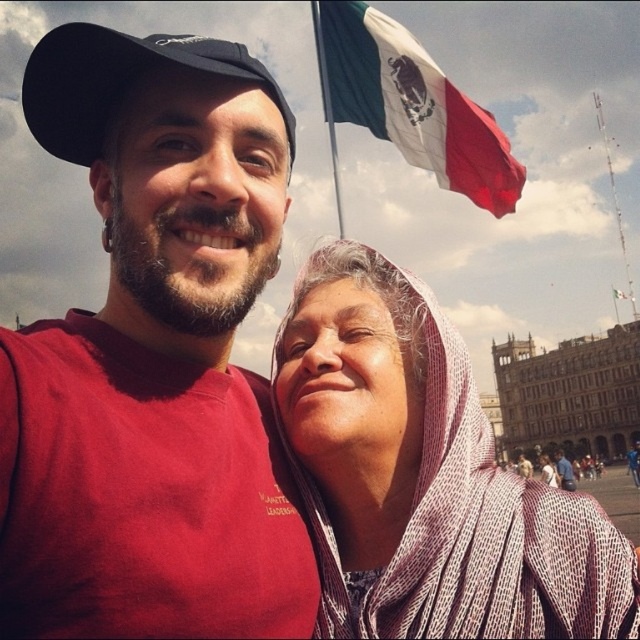
Question: Does matte red t-shirt at center have a smaller size compared to green-white-red fabric flag at upper center?

Choices:
 (A) yes
 (B) no

Answer: (B)

Question: Which object is farther from the camera taking this photo?

Choices:
 (A) white textured scarf at center
 (B) matte red t-shirt at center

Answer: (A)

Question: Which point appears farthest from the camera in this image?

Choices:
 (A) (448, 378)
 (B) (182, 64)
 (C) (444, 118)

Answer: (C)

Question: Does matte red t-shirt at center come in front of green-white-red fabric flag at upper center?

Choices:
 (A) no
 (B) yes

Answer: (B)

Question: Which point is closer to the camera?

Choices:
 (A) (104, 65)
 (B) (420, 118)
 (C) (204, 116)
 (D) (360, 372)

Answer: (A)

Question: Does matte red t-shirt at center have a larger size compared to black fabric baseball cap at upper left?

Choices:
 (A) no
 (B) yes

Answer: (A)